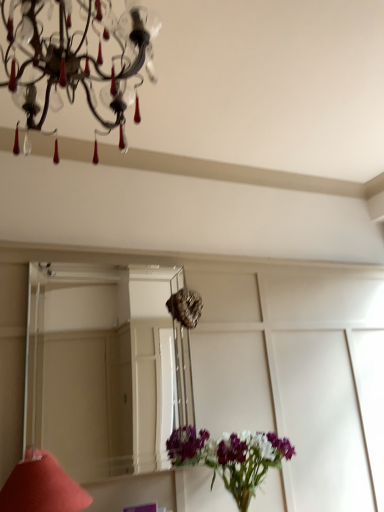
Question: Is crystal glass chandelier at upper left facing away from clear glass mirror at center?

Choices:
 (A) yes
 (B) no

Answer: (B)

Question: From a real-world perspective, is crystal glass chandelier at upper left on top of clear glass mirror at center?

Choices:
 (A) no
 (B) yes

Answer: (B)

Question: From the image's perspective, does crystal glass chandelier at upper left appear lower than clear glass mirror at center?

Choices:
 (A) no
 (B) yes

Answer: (A)

Question: Is crystal glass chandelier at upper left not close to clear glass mirror at center?

Choices:
 (A) yes
 (B) no

Answer: (A)

Question: Does crystal glass chandelier at upper left have a larger size compared to clear glass mirror at center?

Choices:
 (A) yes
 (B) no

Answer: (A)

Question: Considering their positions, is clear glass mirror at center located in front of or behind matte red cone at lower left?

Choices:
 (A) front
 (B) behind

Answer: (B)

Question: Is clear glass mirror at center spatially inside matte red cone at lower left, or outside of it?

Choices:
 (A) inside
 (B) outside

Answer: (B)

Question: Does point (162, 339) appear closer or farther from the camera than point (59, 475)?

Choices:
 (A) closer
 (B) farther

Answer: (B)

Question: From the image's perspective, is clear glass mirror at center positioned above or below matte red cone at lower left?

Choices:
 (A) above
 (B) below

Answer: (A)

Question: Considering the positions of matte red cone at lower left and crystal glass chandelier at upper left in the image, is matte red cone at lower left wider or thinner than crystal glass chandelier at upper left?

Choices:
 (A) wide
 (B) thin

Answer: (B)

Question: From a real-world perspective, is matte red cone at lower left above or below crystal glass chandelier at upper left?

Choices:
 (A) below
 (B) above

Answer: (A)

Question: Relative to crystal glass chandelier at upper left, is matte red cone at lower left in front or behind?

Choices:
 (A) behind
 (B) front

Answer: (A)

Question: From the image's perspective, is matte red cone at lower left positioned above or below crystal glass chandelier at upper left?

Choices:
 (A) above
 (B) below

Answer: (B)

Question: Is point pos(145,41) positioned closer to the camera than point pos(142,316)?

Choices:
 (A) closer
 (B) farther

Answer: (A)

Question: Would you say crystal glass chandelier at upper left is inside or outside clear glass mirror at center?

Choices:
 (A) outside
 (B) inside

Answer: (A)